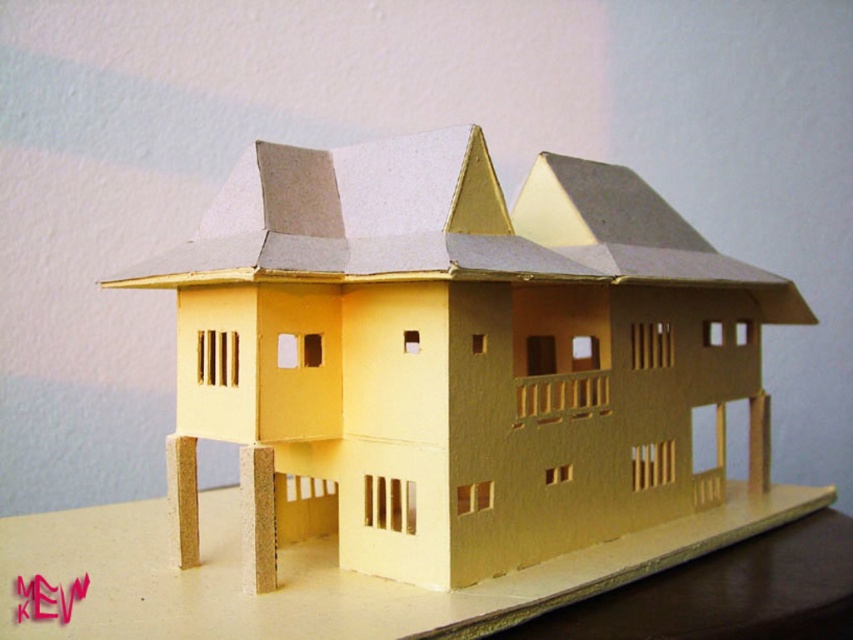
Question: Which object is farther from the camera taking this photo?

Choices:
 (A) matte cardboard table at lower center
 (B) matte cardboard house at center

Answer: (B)

Question: Can you confirm if matte cardboard house at center is positioned above matte cardboard table at lower center?

Choices:
 (A) no
 (B) yes

Answer: (B)

Question: Which point is closer to the camera?

Choices:
 (A) matte cardboard house at center
 (B) matte cardboard table at lower center

Answer: (B)

Question: Does matte cardboard house at center lie in front of matte cardboard table at lower center?

Choices:
 (A) yes
 (B) no

Answer: (B)

Question: Can you confirm if matte cardboard house at center is positioned above matte cardboard table at lower center?

Choices:
 (A) yes
 (B) no

Answer: (A)